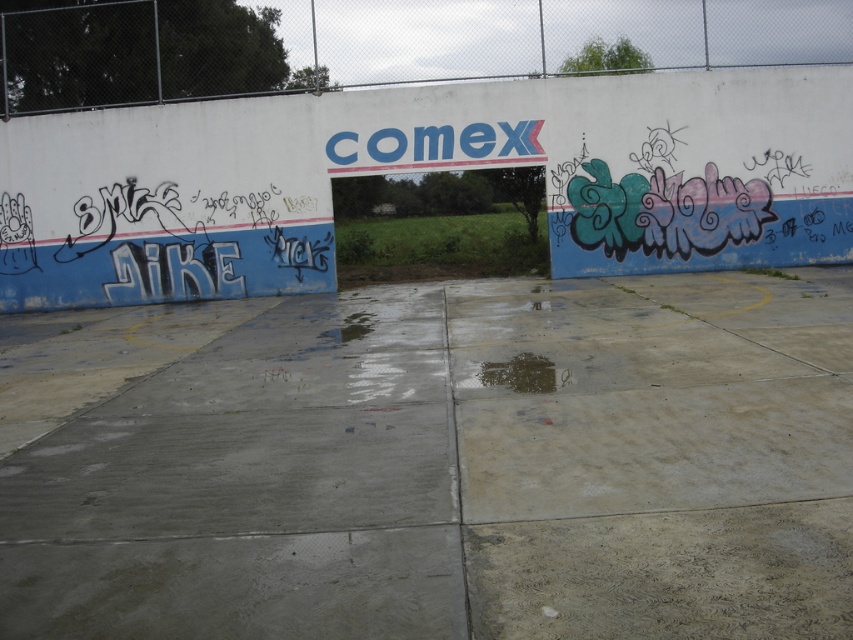
Question: Does gray concrete at center come behind white chain-link fence at upper center?

Choices:
 (A) no
 (B) yes

Answer: (A)

Question: Can you confirm if gray concrete at center is thinner than dark wet concrete puddle at center?

Choices:
 (A) yes
 (B) no

Answer: (B)

Question: Which object is farther from the camera taking this photo?

Choices:
 (A) white chain-link fence at upper center
 (B) dark wet concrete puddle at center

Answer: (A)

Question: Which point is closer to the camera?

Choices:
 (A) (463, 77)
 (B) (581, 573)
 (C) (544, 356)

Answer: (B)

Question: Which is farther from the dark wet concrete puddle at center?

Choices:
 (A) gray concrete at center
 (B) white chain-link fence at upper center

Answer: (B)

Question: Does gray concrete at center appear on the right side of white chain-link fence at upper center?

Choices:
 (A) no
 (B) yes

Answer: (B)